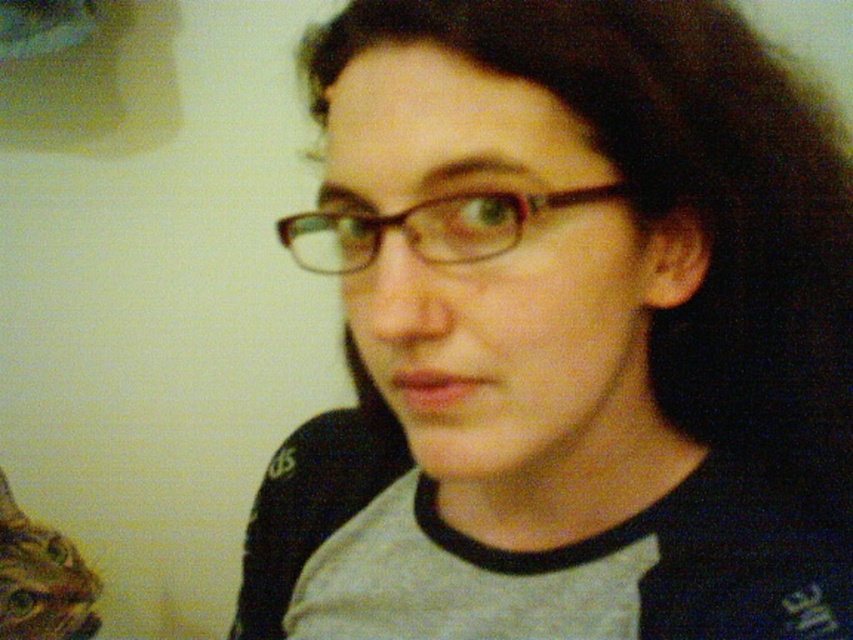
Between matte plastic glasses at center and brown plastic glasses at center, which one is positioned higher?

brown plastic glasses at center

Is matte plastic glasses at center bigger than brown plastic glasses at center?

Yes, matte plastic glasses at center is bigger than brown plastic glasses at center.

Does point (712, 417) lie behind point (521, 202)?

Yes.

This screenshot has height=640, width=853. Find the location of `matte plastic glasses at center`. matte plastic glasses at center is located at coordinates (567, 333).